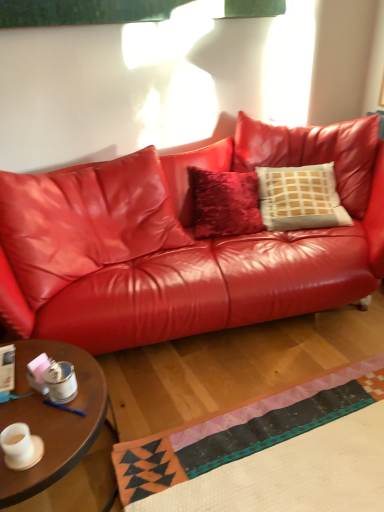
Question: Does wooden round table at lower left appear on the left side of matte white cup at lower left?

Choices:
 (A) no
 (B) yes

Answer: (B)

Question: Is wooden round table at lower left facing towards matte white cup at lower left?

Choices:
 (A) no
 (B) yes

Answer: (A)

Question: Is the position of wooden round table at lower left less distant than that of matte white cup at lower left?

Choices:
 (A) yes
 (B) no

Answer: (A)

Question: Does wooden round table at lower left have a lesser width compared to matte white cup at lower left?

Choices:
 (A) no
 (B) yes

Answer: (A)

Question: Is wooden round table at lower left surrounding matte white cup at lower left?

Choices:
 (A) no
 (B) yes

Answer: (A)

Question: Looking at the image, does wooden round table at lower left seem bigger or smaller compared to glossy leather couch at center?

Choices:
 (A) small
 (B) big

Answer: (A)

Question: Is wooden round table at lower left in front of or behind glossy leather couch at center in the image?

Choices:
 (A) behind
 (B) front

Answer: (B)

Question: Does point (44, 488) appear closer or farther from the camera than point (249, 320)?

Choices:
 (A) closer
 (B) farther

Answer: (A)

Question: Considering the positions of wooden round table at lower left and glossy leather couch at center in the image, is wooden round table at lower left taller or shorter than glossy leather couch at center?

Choices:
 (A) short
 (B) tall

Answer: (A)

Question: From a real-world perspective, is matte white cup at lower left positioned above or below wooden round table at lower left?

Choices:
 (A) below
 (B) above

Answer: (B)

Question: Is matte white cup at lower left to the left or to the right of wooden round table at lower left in the image?

Choices:
 (A) left
 (B) right

Answer: (B)

Question: Is point (18, 459) closer or farther from the camera than point (67, 457)?

Choices:
 (A) farther
 (B) closer

Answer: (B)

Question: From their relative heights in the image, would you say matte white cup at lower left is taller or shorter than wooden round table at lower left?

Choices:
 (A) tall
 (B) short

Answer: (B)

Question: Is point (41, 231) positioned closer to the camera than point (69, 460)?

Choices:
 (A) farther
 (B) closer

Answer: (A)

Question: Is glossy leather couch at center wider or thinner than wooden round table at lower left?

Choices:
 (A) wide
 (B) thin

Answer: (A)